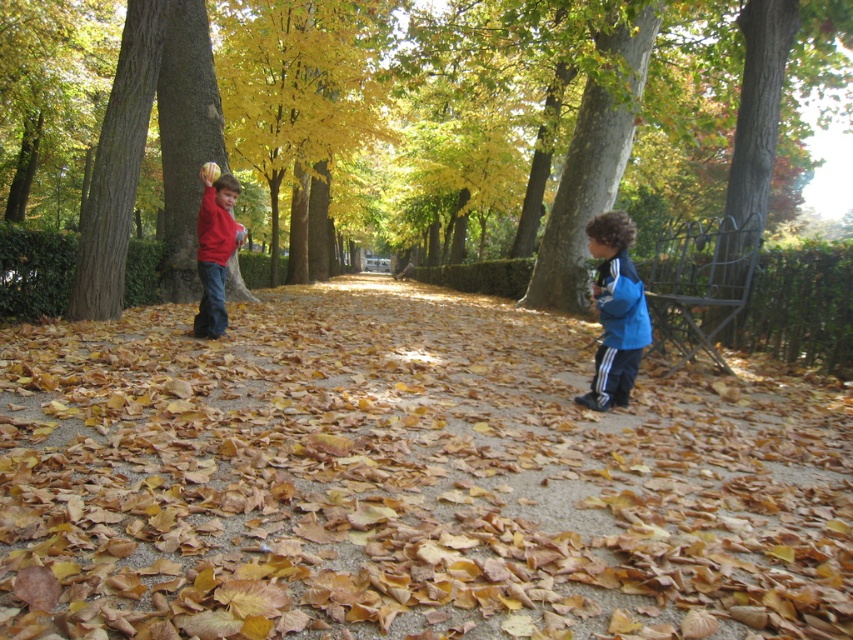
In the autumn park scene, there are two children wearing different clothing items. The first child is wearing a matte red sweater at left and stands on the left side of the frame, while the second child is wearing a blue fleece jacket at right. From the perspective of an observer looking at the image, which clothing item is positioned to the right of the other?

The blue fleece jacket at right is positioned to the right of the matte red sweater at left.

You are a parent trying to locate your two children playing in the park. You see the blue fleece jacket at right and the matte red sweater at left. Which child is closer to the ground?

The blue fleece jacket at right is located below matte red sweater at left, so the child wearing the blue fleece jacket at right is closer to the ground.

You are standing at the camera position and want to throw a ball to the child wearing the blue fleece jacket at right. The throwing distance is 15 feet. Will the ball reach the child?

The blue fleece jacket at right is 15.58 feet away from the camera. Since the throwing distance is 15 feet, the ball will fall short by approximately 0.58 feet and won not reach the child.